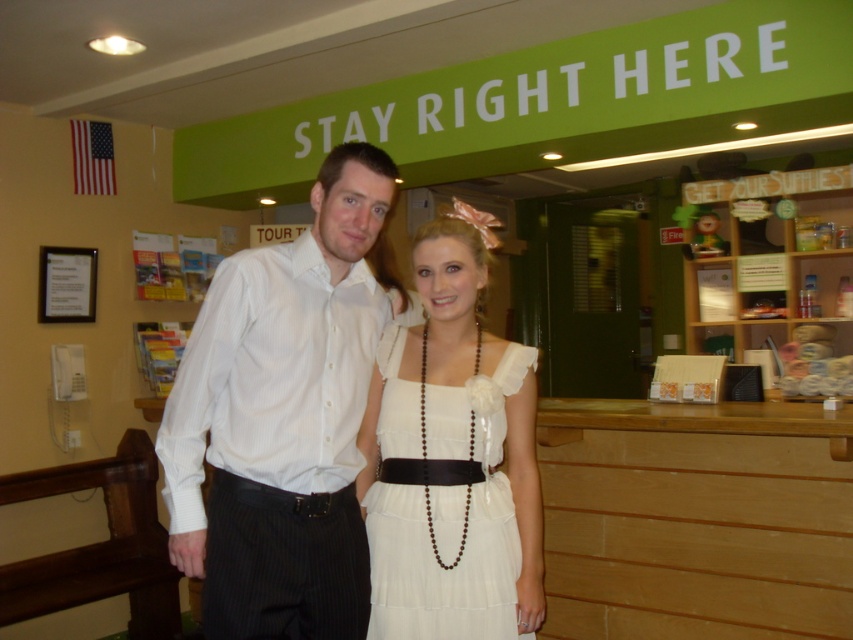
Question: Which of these objects is positioned closest to the white satin dress at center?

Choices:
 (A) white striped shirt at center
 (B) wooden at right

Answer: (A)

Question: Is white striped shirt at center positioned before white satin dress at center?

Choices:
 (A) no
 (B) yes

Answer: (B)

Question: Which is nearer to the wooden at right?

Choices:
 (A) white satin dress at center
 (B) white striped shirt at center

Answer: (A)

Question: Is white striped shirt at center above white satin dress at center?

Choices:
 (A) no
 (B) yes

Answer: (B)

Question: Which of the following is the farthest from the observer?

Choices:
 (A) white striped shirt at center
 (B) white satin dress at center

Answer: (B)

Question: Can you confirm if wooden at right is positioned to the left of white satin dress at center?

Choices:
 (A) yes
 (B) no

Answer: (B)